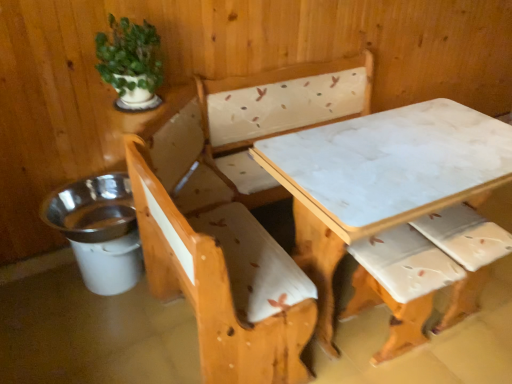
Question: Would you say green matte plant at upper left is inside or outside white marble table at center?

Choices:
 (A) inside
 (B) outside

Answer: (B)

Question: Considering their positions, is green matte plant at upper left located in front of or behind white marble table at center?

Choices:
 (A) behind
 (B) front

Answer: (A)

Question: Is point (126, 104) positioned closer to the camera than point (433, 160)?

Choices:
 (A) closer
 (B) farther

Answer: (B)

Question: Is white marble table at center situated inside green matte plant at upper left or outside?

Choices:
 (A) inside
 (B) outside

Answer: (B)

Question: Is point (356, 160) closer or farther from the camera than point (155, 94)?

Choices:
 (A) farther
 (B) closer

Answer: (B)

Question: Based on their sizes in the image, would you say white marble table at center is bigger or smaller than green matte plant at upper left?

Choices:
 (A) small
 (B) big

Answer: (B)

Question: In terms of width, does white marble table at center look wider or thinner when compared to green matte plant at upper left?

Choices:
 (A) wide
 (B) thin

Answer: (A)